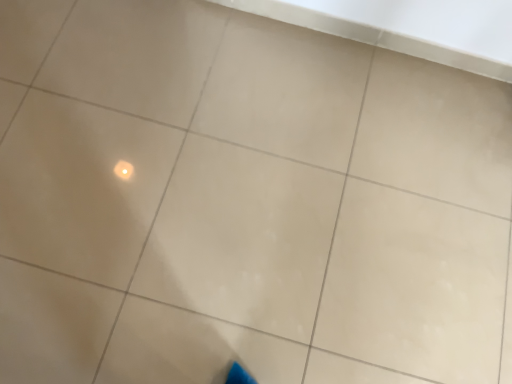
Measure the distance between white glossy bathtub at upper right and camera.

A distance of 3.92 feet exists between white glossy bathtub at upper right and camera.

In order to face white glossy bathtub at upper right, should I rotate leftwards or rightwards?

Rotate your view right by about 11.646°.

Identify the location of white glossy bathtub at upper right. This screenshot has height=384, width=512. (409, 27).

What do you see at coordinates (409, 27) in the screenshot? I see `white glossy bathtub at upper right` at bounding box center [409, 27].

Identify the location of white glossy bathtub at upper right. (409, 27).